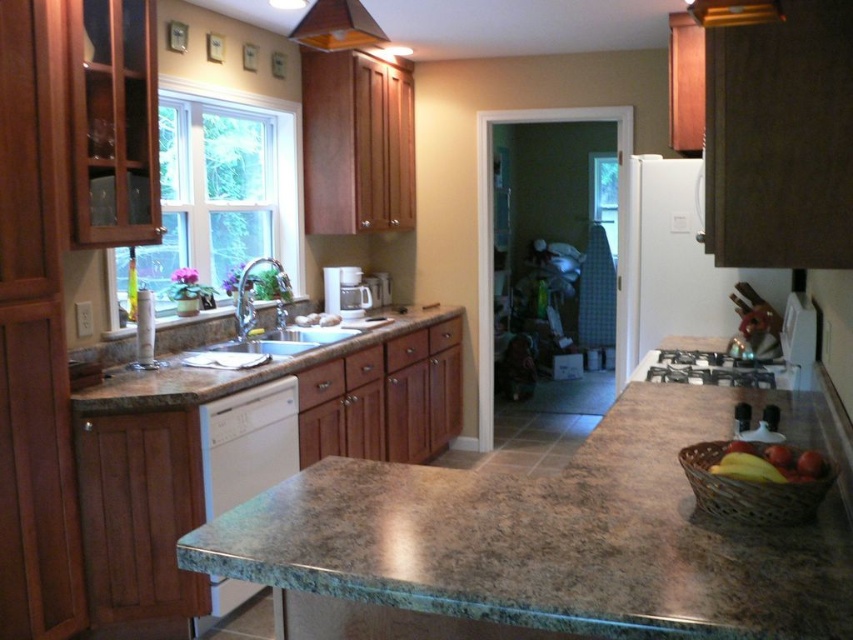
Is orange matte exhaust hood at upper center to the left of shiny red apple at right from the viewer's perspective?

Indeed, orange matte exhaust hood at upper center is positioned on the left side of shiny red apple at right.

Is orange matte exhaust hood at upper center shorter than shiny red apple at right?

Incorrect, orange matte exhaust hood at upper center's height does not fall short of shiny red apple at right's.

What do you see at coordinates (337, 26) in the screenshot? I see `orange matte exhaust hood at upper center` at bounding box center [337, 26].

I want to click on orange matte exhaust hood at upper center, so click(x=337, y=26).

Based on the photo, does white glossy dishwasher at lower left have a greater width compared to orange matte exhaust hood at upper center?

Yes, white glossy dishwasher at lower left is wider than orange matte exhaust hood at upper center.

Is point (265, 426) positioned in front of point (373, 40)?

No, it is not.

The height and width of the screenshot is (640, 853). Find the location of `white glossy dishwasher at lower left`. white glossy dishwasher at lower left is located at coordinates (247, 444).

Who is shorter, white glossy dishwasher at lower left or white matte coffee maker at center?

With less height is white matte coffee maker at center.

Does point (248, 488) lie behind point (331, 300)?

No, it is in front of (331, 300).

You are a GUI agent. You are given a task and a screenshot of the screen. Output one action in this format:
    pyautogui.click(x=<x>, y=<y>)
    Task: Click on the white glossy dishwasher at lower left
    This screenshot has height=640, width=853.
    Given the screenshot: What is the action you would take?
    pyautogui.click(x=247, y=444)